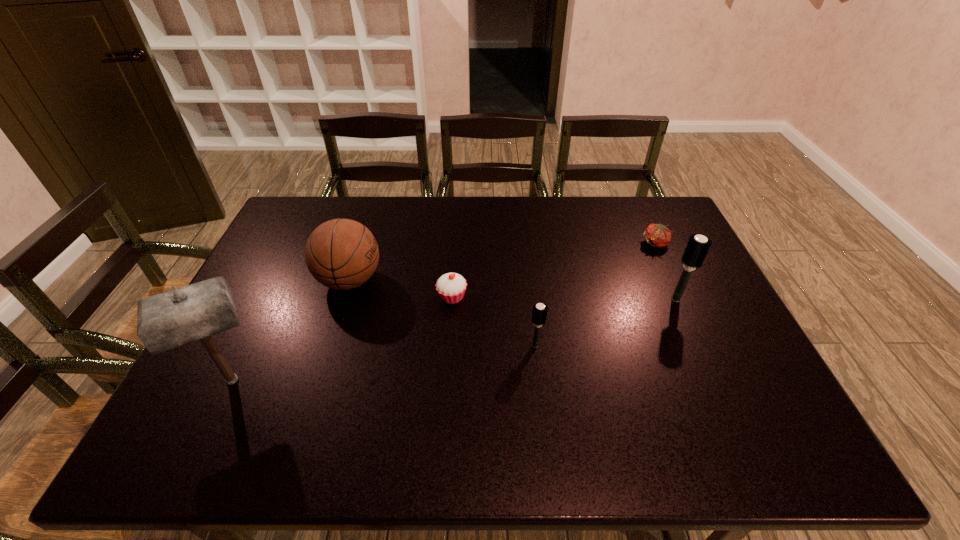
This screenshot has width=960, height=540. Identify the location of the fifth farthest object. (539, 312).

This screenshot has height=540, width=960. Find the location of `the shorter hairbrush`. the shorter hairbrush is located at coordinates (539, 312).

Where is `the taller hairbrush`? Image resolution: width=960 pixels, height=540 pixels. the taller hairbrush is located at coordinates (697, 248).

Locate an element on the screen. This screenshot has height=540, width=960. the farther hairbrush is located at coordinates (697, 248).

Locate an element on the screen. basketball is located at coordinates [x=342, y=254].

Locate an element on the screen. The width and height of the screenshot is (960, 540). tomato is located at coordinates (657, 235).

This screenshot has height=540, width=960. In order to click on the shortest object in this screenshot , I will do `click(657, 235)`.

You are a GUI agent. You are given a task and a screenshot of the screen. Output one action in this format:
    pyautogui.click(x=<x>, y=<y>)
    Task: Click on the cupcake
    This screenshot has height=540, width=960.
    Given the screenshot: What is the action you would take?
    pyautogui.click(x=451, y=287)

Identify the location of the fourth object from right to left. (451, 287).

Identify the location of the leftmost object. (171, 319).